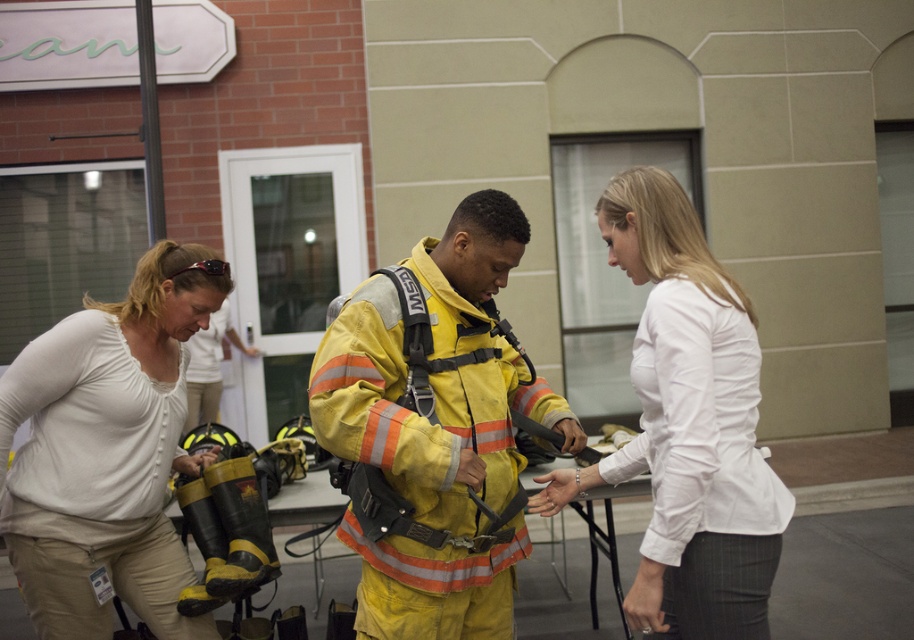
Who is shorter, light beige pants at lower left or yellow reflective jacket at center?

With less height is yellow reflective jacket at center.

Who is more distant from viewer, (36, 433) or (187, 387)?

Point (187, 387)

Where is `light beige pants at lower left`? The width and height of the screenshot is (914, 640). light beige pants at lower left is located at coordinates (105, 451).

The width and height of the screenshot is (914, 640). Describe the element at coordinates (434, 429) in the screenshot. I see `yellow reflective uniform at center` at that location.

Can you confirm if yellow reflective uniform at center is taller than white smooth shirt at center?

Yes, yellow reflective uniform at center is taller than white smooth shirt at center.

At what (x,y) coordinates should I click in order to perform the action: click on yellow reflective uniform at center. Please return your answer as a coordinate pair (x, y). Looking at the image, I should click on (434, 429).

Does light beige pants at lower left appear over white smooth shirt at center?

Actually, light beige pants at lower left is below white smooth shirt at center.

Does point (146, 364) come closer to viewer compared to point (707, 256)?

No, it is behind (707, 256).

This screenshot has width=914, height=640. What do you see at coordinates (105, 451) in the screenshot?
I see `light beige pants at lower left` at bounding box center [105, 451].

Locate an element on the screen. This screenshot has height=640, width=914. light beige pants at lower left is located at coordinates [x=105, y=451].